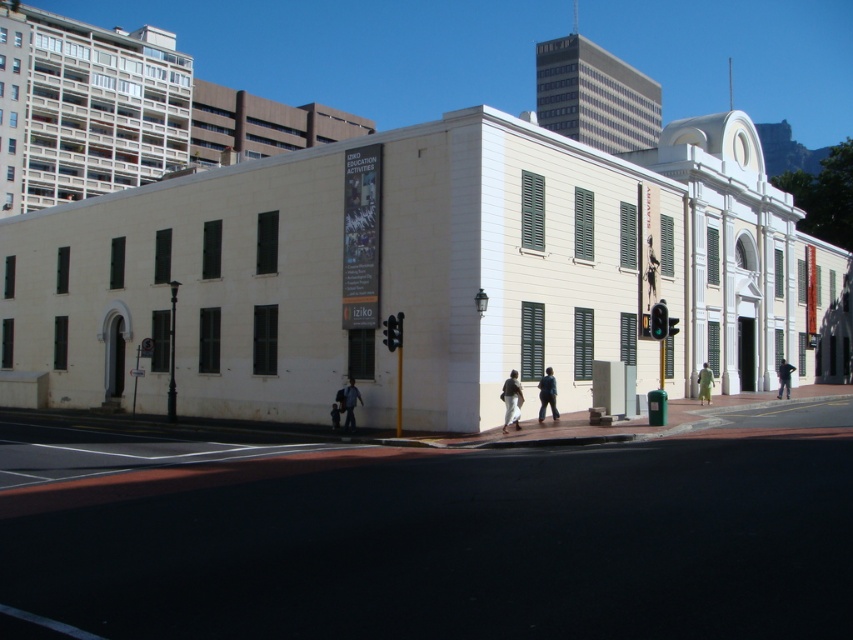
Question: Is dark blue jeans at lower left smaller than light blue fabric at center?

Choices:
 (A) yes
 (B) no

Answer: (B)

Question: Can you confirm if dark blue jeans at lower left is smaller than light blue fabric at center?

Choices:
 (A) yes
 (B) no

Answer: (B)

Question: Estimate the real-world distances between objects in this image. Which object is farther from the brown leather jacket at center?

Choices:
 (A) green fabric dress at lower right
 (B) light blue fabric at center
 (C) dark blue jeans at lower left

Answer: (A)

Question: Which point appears closest to the camera in this image?

Choices:
 (A) (705, 394)
 (B) (509, 384)
 (C) (339, 426)

Answer: (B)

Question: Which object appears closest to the camera in this image?

Choices:
 (A) brown leather jacket at center
 (B) green fabric dress at lower right
 (C) dark blue jeans at lower left

Answer: (A)

Question: Is dark blue jacket at center thinner than light blue fabric at center?

Choices:
 (A) yes
 (B) no

Answer: (B)